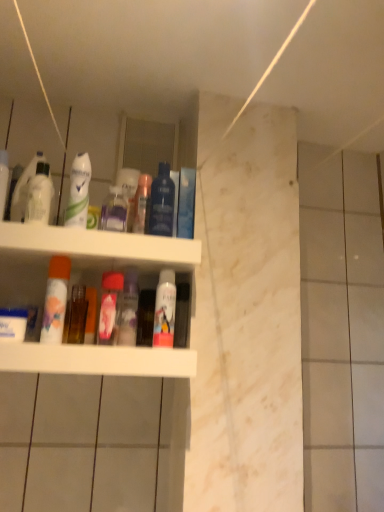
Question: Can you confirm if white matte mouthwash at center, which ranks as the fifth mouthwash in left-to-right order, is wider than blue glossy box at upper center, the 1th toiletry positioned from the right?

Choices:
 (A) yes
 (B) no

Answer: (B)

Question: Is white matte mouthwash at center, which appears as the first mouthwash when viewed from the right, in front of blue glossy box at upper center, the 1th toiletry positioned from the right?

Choices:
 (A) yes
 (B) no

Answer: (A)

Question: Does white matte mouthwash at center, which ranks as the fifth mouthwash in left-to-right order, turn towards blue glossy box at upper center, the 1th toiletry positioned from the right?

Choices:
 (A) no
 (B) yes

Answer: (A)

Question: Is white matte mouthwash at center, which appears as the first mouthwash when viewed from the right, to the left of blue glossy box at upper center, the third toiletry when ordered from left to right, from the viewer's perspective?

Choices:
 (A) no
 (B) yes

Answer: (B)

Question: Is white matte mouthwash at center, which ranks as the fifth mouthwash in left-to-right order, positioned with its back to blue glossy box at upper center, the 1th toiletry positioned from the right?

Choices:
 (A) yes
 (B) no

Answer: (B)

Question: Is white matte mouthwash at center, which ranks as the fifth mouthwash in left-to-right order, to the right of blue glossy box at upper center, the 1th toiletry positioned from the right, from the viewer's perspective?

Choices:
 (A) no
 (B) yes

Answer: (A)

Question: Is the position of pink glossy mouthwash at center, which ranks as the third mouthwash in right-to-left order, less distant than that of transparent plastic bottle at upper center, placed as the second cleaning product when sorted from front to back?

Choices:
 (A) yes
 (B) no

Answer: (A)

Question: Is pink glossy mouthwash at center, which ranks as the third mouthwash in right-to-left order, thinner than transparent plastic bottle at upper center, the 2th cleaning product positioned from the left?

Choices:
 (A) no
 (B) yes

Answer: (A)

Question: Is pink glossy mouthwash at center, the third mouthwash viewed from the left, positioned beyond the bounds of transparent plastic bottle at upper center, positioned as the 1th cleaning product in right-to-left order?

Choices:
 (A) no
 (B) yes

Answer: (B)

Question: Considering the relative sizes of pink glossy mouthwash at center, which ranks as the third mouthwash in right-to-left order, and transparent plastic bottle at upper center, the 2th cleaning product positioned from the left, in the image provided, is pink glossy mouthwash at center, which ranks as the third mouthwash in right-to-left order, smaller than transparent plastic bottle at upper center, the 2th cleaning product positioned from the left,?

Choices:
 (A) yes
 (B) no

Answer: (B)

Question: Does pink glossy mouthwash at center, the third mouthwash viewed from the left, touch transparent plastic bottle at upper center, placed as the second cleaning product when sorted from front to back?

Choices:
 (A) no
 (B) yes

Answer: (A)

Question: Is there a large distance between pink glossy mouthwash at center, which ranks as the third mouthwash in right-to-left order, and transparent plastic bottle at upper center, positioned as the 1th cleaning product in right-to-left order?

Choices:
 (A) no
 (B) yes

Answer: (A)

Question: Is there a large distance between pink matte spray can at center, acting as the third toiletry starting from the right, and white glossy deodorant at upper left, marked as the 1th cleaning product in a front-to-back arrangement?

Choices:
 (A) no
 (B) yes

Answer: (A)